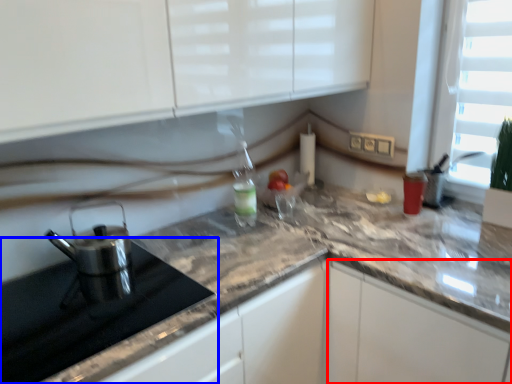
Question: Which of the following is the closest to the observer, cabinetry (highlighted by a red box) or appliance (highlighted by a blue box)?

Choices:
 (A) cabinetry
 (B) appliance

Answer: (B)